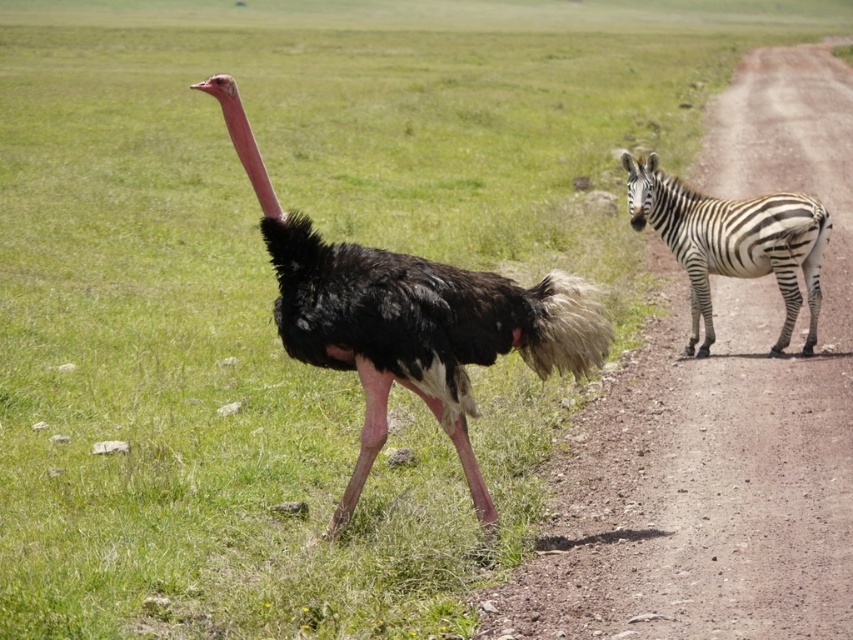
Question: Which point appears farthest from the camera in this image?

Choices:
 (A) (706, 198)
 (B) (451, 388)
 (C) (599, 456)

Answer: (A)

Question: Does black feathered ostrich at center appear on the left side of black and white stripes at right?

Choices:
 (A) no
 (B) yes

Answer: (B)

Question: Is dirttrack at right further to camera compared to black and white stripes at right?

Choices:
 (A) yes
 (B) no

Answer: (B)

Question: Which of the following is the closest to the observer?

Choices:
 (A) dirttrack at right
 (B) black feathered ostrich at center
 (C) black and white striped zebra at right
 (D) black and white stripes at right

Answer: (A)

Question: Which point is farther from the camera taking this photo?

Choices:
 (A) click(x=686, y=186)
 (B) click(x=369, y=353)

Answer: (A)

Question: In this image, where is black feathered ostrich at center located relative to black and white striped zebra at right?

Choices:
 (A) above
 (B) below

Answer: (B)